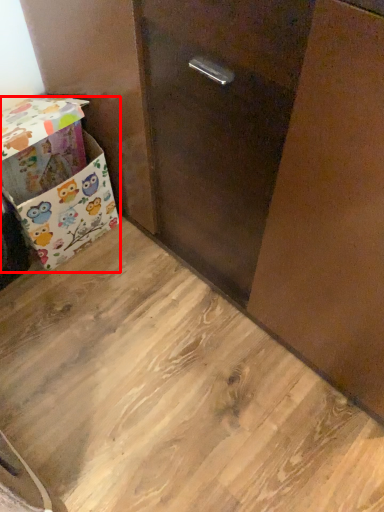
Question: From the image's perspective, what is the correct spatial positioning of box (annotated by the red box) in reference to plywood?

Choices:
 (A) below
 (B) above

Answer: (B)